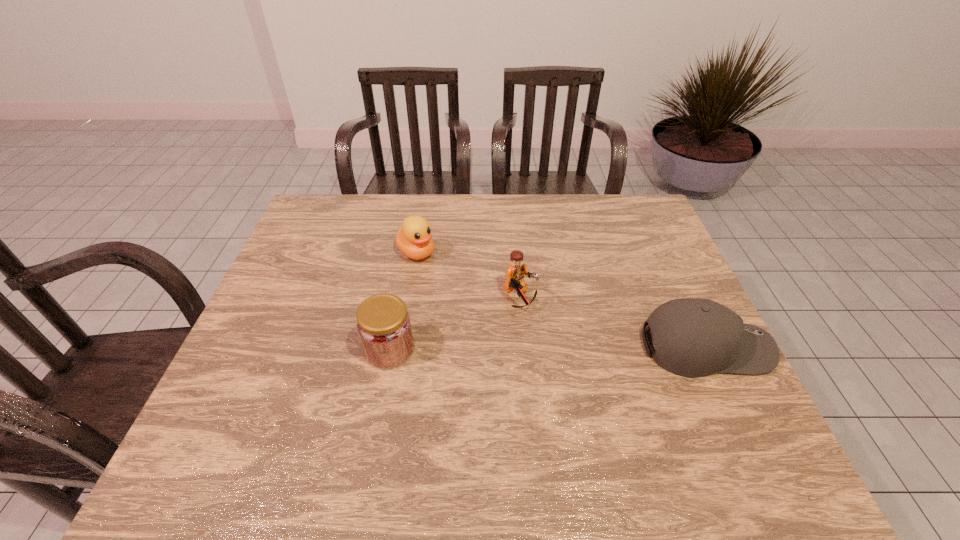
Locate an element on the screen. The height and width of the screenshot is (540, 960). free space that satisfies the following two spatial constraints: 1. on the front side of the farthest object; 2. on the right side of the Lego is located at coordinates (409, 298).